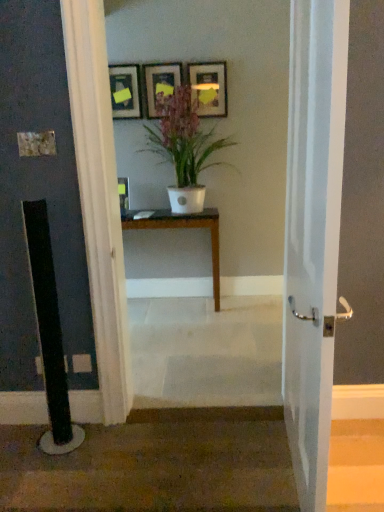
Find the location of a particular element. Image resolution: width=384 pixels, height=512 pixels. free spot below wooden table at center (from a real-world perspective) is located at coordinates (183, 308).